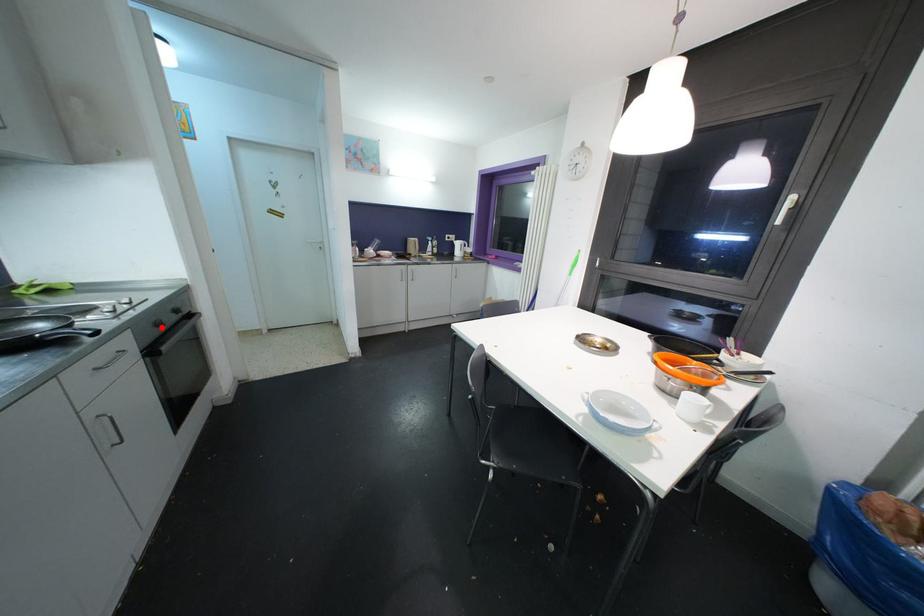
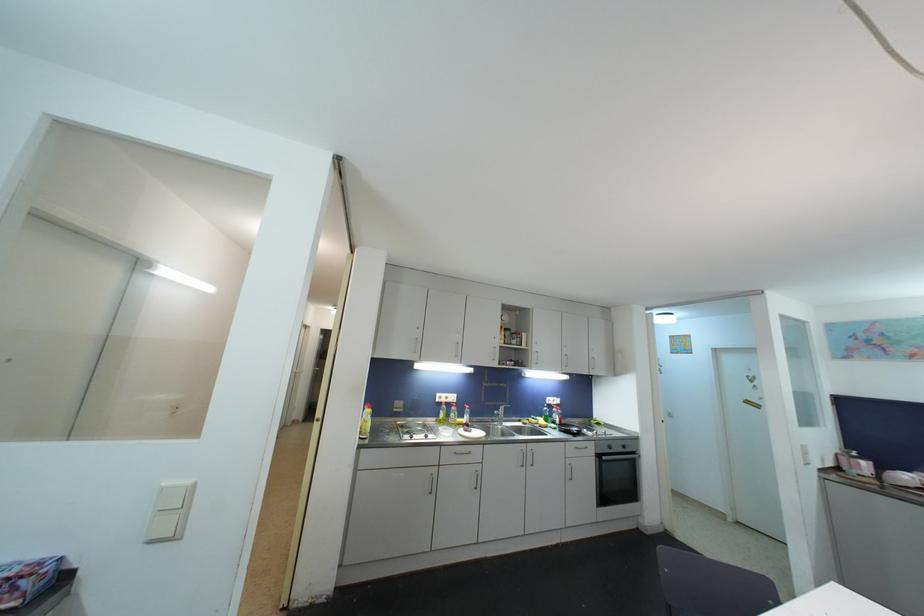
Question: I am providing you with two images of the same scene from different viewpoints. Image1 has a red point marked. In image2, the corresponding 3D location appears at what relative position? Reply with the corresponding letter.

Choices:
 (A) Closer
 (B) Farther

Answer: (B)